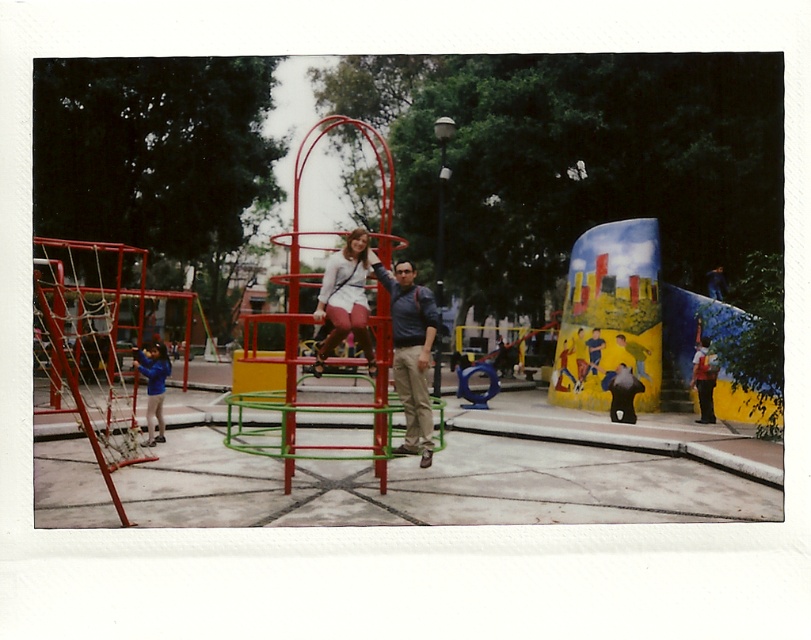
Is point (513, 244) more distant than point (419, 428)?

Yes, it is.

Is metallic red playground equipment at center positioned behind matte blue shirt at center?

No, it is not.

Identify the location of metallic red playground equipment at center. (575, 170).

Does matte blue shirt at center appear on the left side of matte pink pants at center?

In fact, matte blue shirt at center is to the right of matte pink pants at center.

In the scene shown: Can you confirm if matte blue shirt at center is positioned above matte pink pants at center?

Incorrect, matte blue shirt at center is not positioned above matte pink pants at center.

Describe the element at coordinates (410, 353) in the screenshot. The image size is (811, 640). I see `matte blue shirt at center` at that location.

Locate an element on the screen. The image size is (811, 640). matte blue shirt at center is located at coordinates (410, 353).

Identify the location of metallic red playground equipment at center. (575, 170).

Is point (479, 104) positioned before point (142, 355)?

No, (479, 104) is behind (142, 355).

This screenshot has width=811, height=640. I want to click on metallic red playground equipment at center, so click(575, 170).